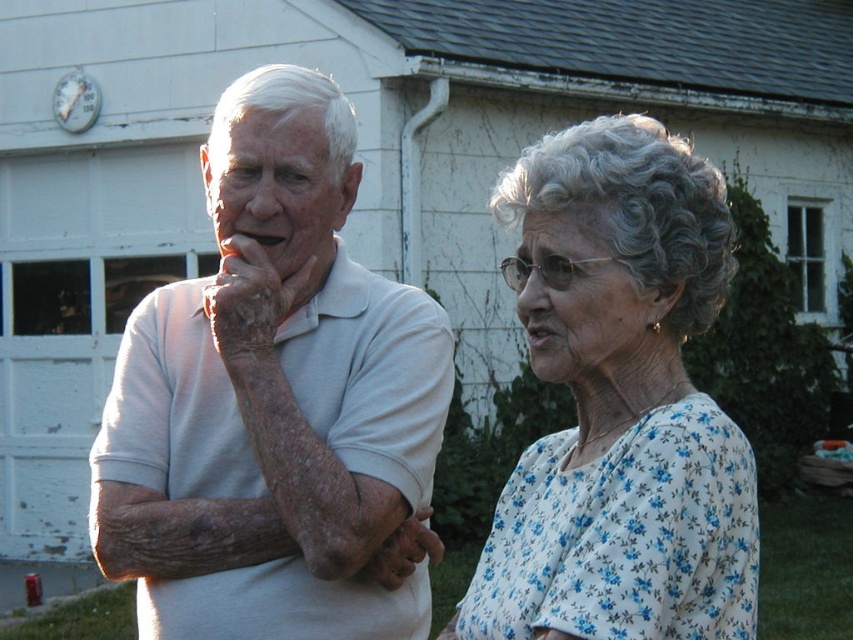
Question: Among these points, which one is farthest from the camera?

Choices:
 (A) (380, 566)
 (B) (251, 593)
 (C) (608, 230)

Answer: (A)

Question: Does white matte shirt at center appear under dry skin at left?

Choices:
 (A) no
 (B) yes

Answer: (B)

Question: Which point appears closest to the camera in this image?

Choices:
 (A) (265, 269)
 (B) (624, 243)

Answer: (B)

Question: Does white floral blouse at center have a lesser width compared to dry skin hand at center?

Choices:
 (A) no
 (B) yes

Answer: (A)

Question: Can you confirm if dry skin at left is positioned to the left of dry skin hand at center?

Choices:
 (A) no
 (B) yes

Answer: (B)

Question: Which is nearer to the white matte shirt at center?

Choices:
 (A) dry skin at left
 (B) white floral blouse at center
 (C) dry skin hand at center

Answer: (A)